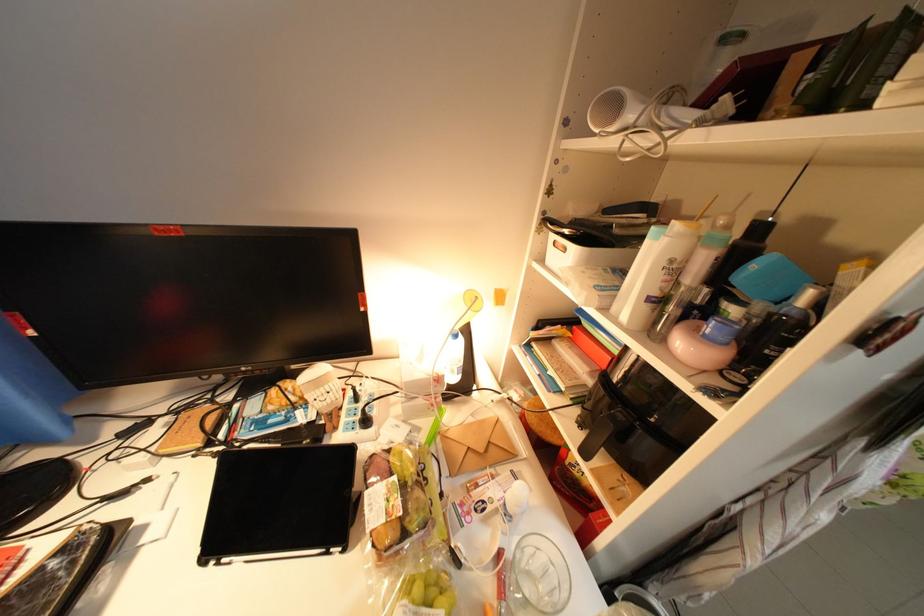
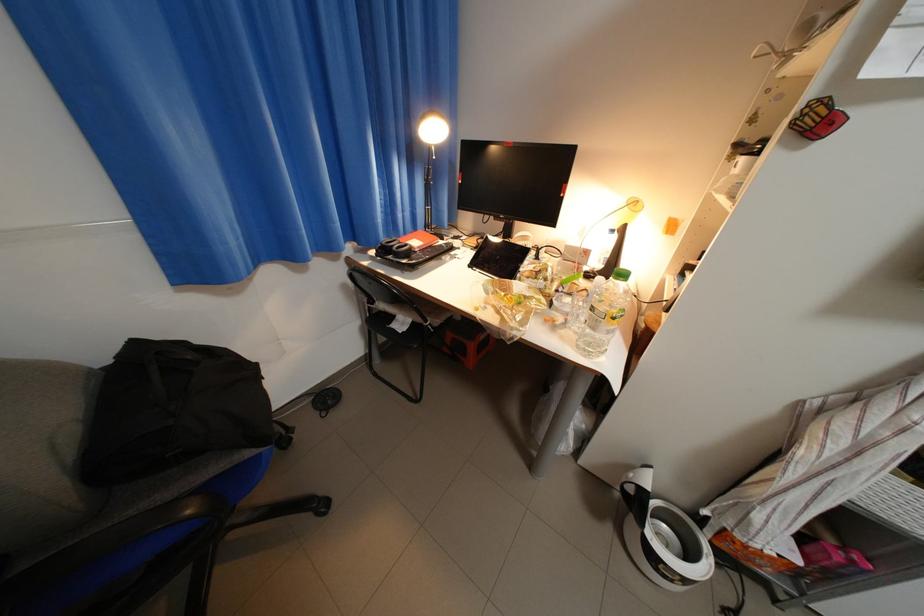
Find the pixel in the second image that matches point 94,389 in the first image.

(469, 209)